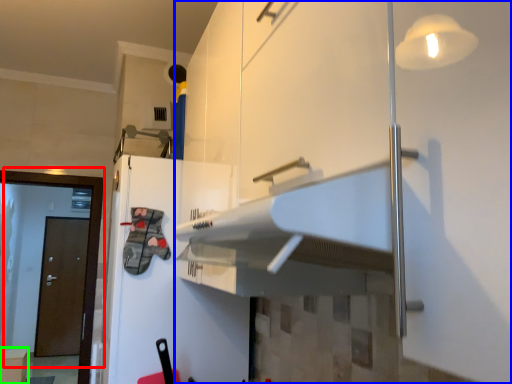
Question: Which is farther away from door (highlighted by a red box)? cabinetry (highlighted by a blue box) or cabinetry (highlighted by a green box)?

Choices:
 (A) cabinetry
 (B) cabinetry

Answer: (B)